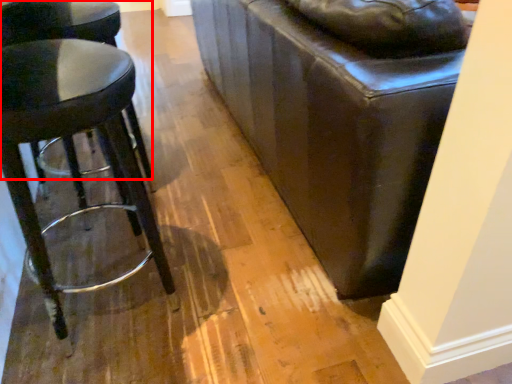
Question: Where is stool (annotated by the red box) located in relation to stool in the image?

Choices:
 (A) left
 (B) right

Answer: (A)